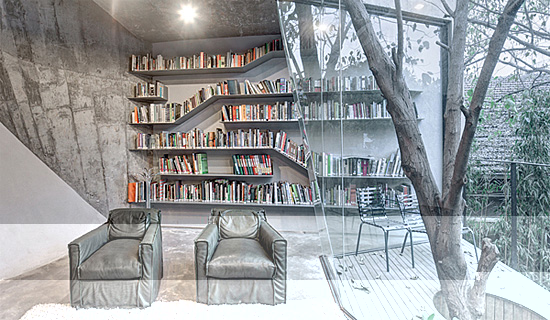
The width and height of the screenshot is (550, 320). I want to click on chair, so (x=126, y=248).